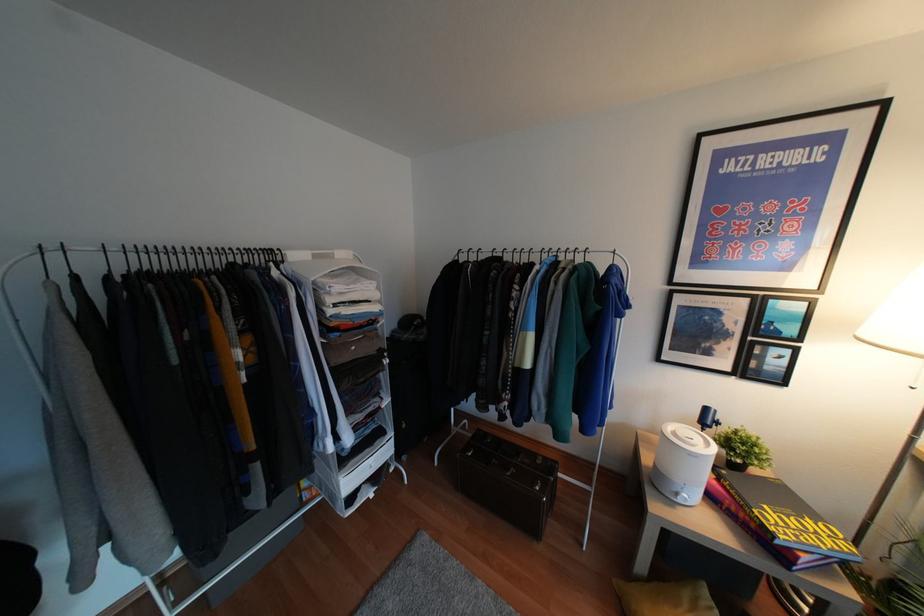
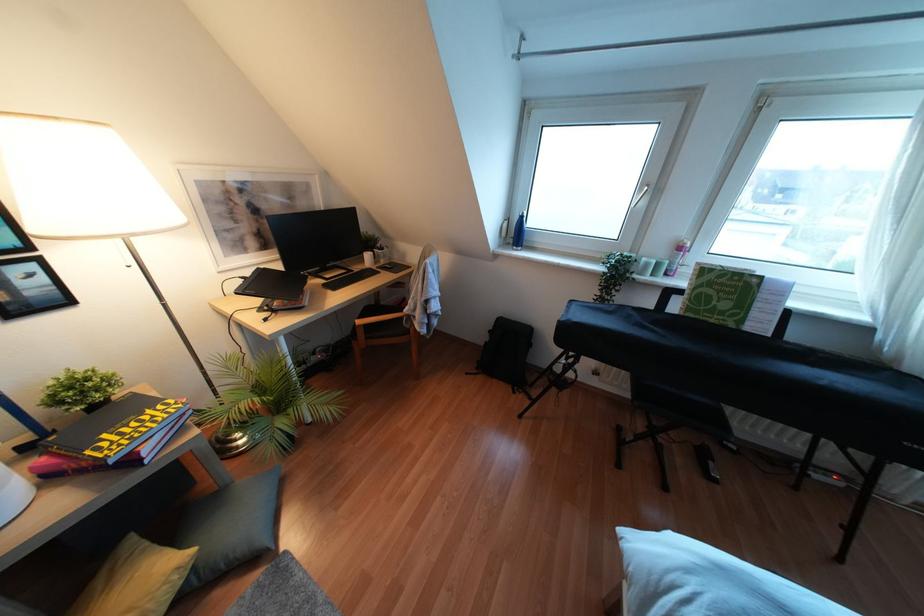
The first image is from the beginning of the video and the second image is from the end. How did the camera likely rotate when shooting the video?

The camera's rotation is toward right-down.